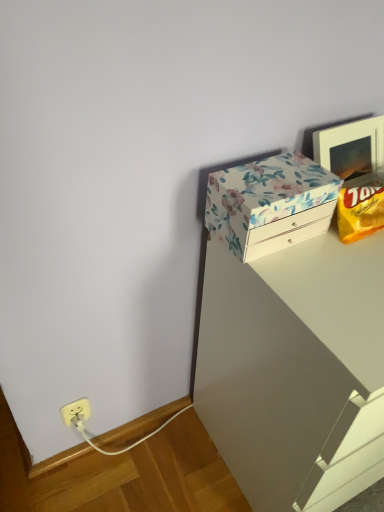
The image size is (384, 512). Identify the location of free spot above floral paper-covered box at upper right (from a real-world perspective). (276, 175).